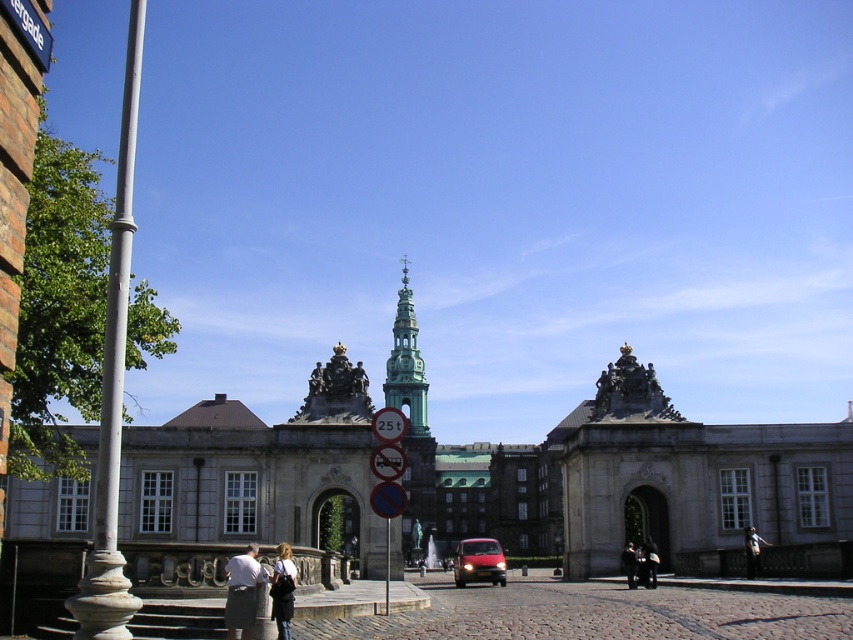
Can you confirm if green stone tower at center is positioned above dark brown leather jacket at lower right?

Correct, green stone tower at center is located above dark brown leather jacket at lower right.

Is point (408, 406) behind point (643, 570)?

Yes, it is.

At what (x,y) coordinates should I click in order to perform the action: click on green stone tower at center. Please return your answer as a coordinate pair (x, y). Looking at the image, I should click on (410, 420).

The width and height of the screenshot is (853, 640). Identify the location of light gray fabric jacket at lower center. click(242, 592).

Who is higher up, light gray fabric jacket at lower center or dark gray fabric couple at center?

Positioned higher is light gray fabric jacket at lower center.

The width and height of the screenshot is (853, 640). Describe the element at coordinates (242, 592) in the screenshot. I see `light gray fabric jacket at lower center` at that location.

What are the coordinates of `light gray fabric jacket at lower center` in the screenshot? It's located at (242, 592).

Which is in front, point (395, 314) or point (381, 465)?

Point (381, 465)

Does green stone tower at center appear on the left side of metallic circular sign at center?

Correct, you'll find green stone tower at center to the left of metallic circular sign at center.

Describe the element at coordinates (410, 420) in the screenshot. I see `green stone tower at center` at that location.

Where is `green stone tower at center`? This screenshot has width=853, height=640. green stone tower at center is located at coordinates (410, 420).